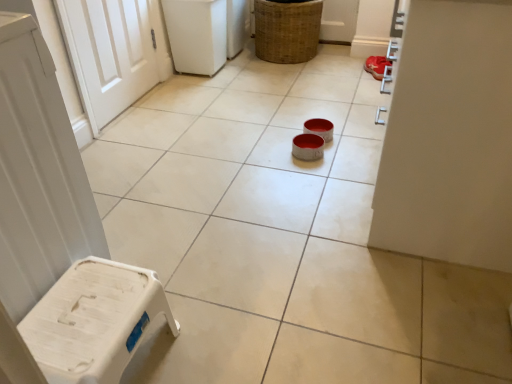
What are the coordinates of `vacant area that lies in front of woven brown basket at upper center` in the screenshot? It's located at (290, 84).